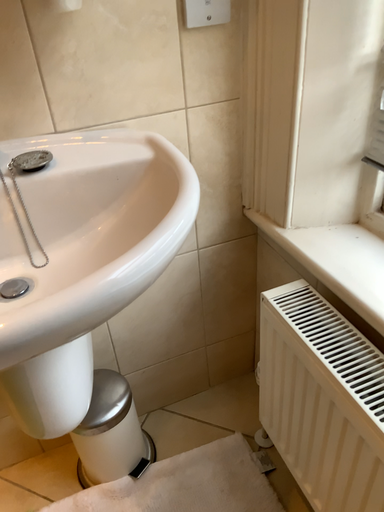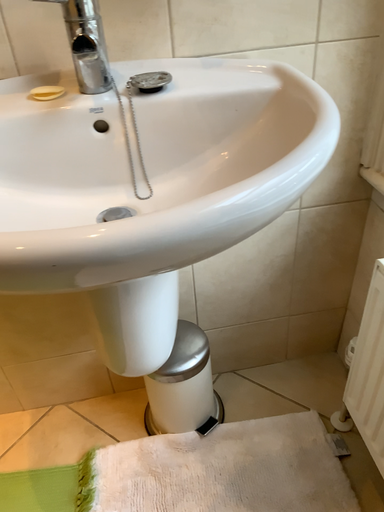
Question: Which way did the camera rotate in the video?

Choices:
 (A) rotated right
 (B) rotated left

Answer: (B)